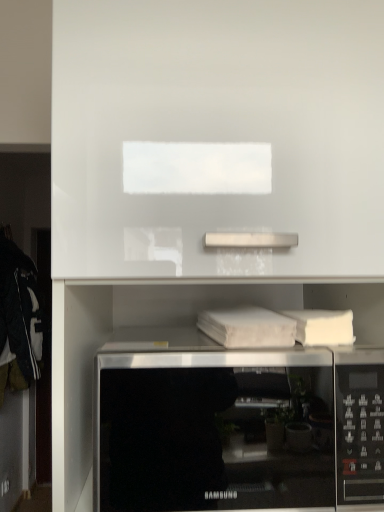
Find the location of `white matte book at center`. white matte book at center is located at coordinates (248, 328).

What do you see at coordinates (237, 430) in the screenshot?
I see `satin silver microwave at lower center` at bounding box center [237, 430].

Find the location of `white matte book at center`. white matte book at center is located at coordinates (x=248, y=328).

Which is behind, point (279, 412) or point (75, 109)?

The point (279, 412) is more distant.

Does satin silver microwave at lower center have a lesser width compared to white glossy cabinet at upper center?

Correct, the width of satin silver microwave at lower center is less than that of white glossy cabinet at upper center.

Is satin silver microwave at lower center in contact with white glossy cabinet at upper center?

No.

At what (x,y) coordinates should I click in order to perform the action: click on microwave oven below the white glossy cabinet at upper center (from a real-world perspective). Please return your answer as a coordinate pair (x, y). The width and height of the screenshot is (384, 512). Looking at the image, I should click on click(237, 430).

Which object is thinner, white glossy cabinet at upper center or white matte book at center?

white matte book at center.

Considering their positions, is white glossy cabinet at upper center located in front of or behind white matte book at center?

Clearly, white glossy cabinet at upper center is in front of white matte book at center.

Looking at this image, from the image's perspective, does white glossy cabinet at upper center appear lower than white matte book at center?

No, from the image's perspective, white glossy cabinet at upper center is not below white matte book at center.

From their relative heights in the image, would you say white glossy cabinet at upper center is taller or shorter than white matte book at center?

Considering their sizes, white glossy cabinet at upper center has more height than white matte book at center.

Which object is wider, white matte book at center or satin silver microwave at lower center?

With larger width is satin silver microwave at lower center.

Between white matte book at center and satin silver microwave at lower center, which one appears on the left side from the viewer's perspective?

satin silver microwave at lower center.

Looking at this image, which object is further away from the camera, white matte book at center or satin silver microwave at lower center?

white matte book at center is further from the camera.

Consider the image. Considering the positions of objects white glossy cabinet at upper center and satin silver microwave at lower center in the image provided, who is behind, white glossy cabinet at upper center or satin silver microwave at lower center?

satin silver microwave at lower center is more distant.

Based on the photo, is white glossy cabinet at upper center aimed at satin silver microwave at lower center?

Yes, white glossy cabinet at upper center is turned towards satin silver microwave at lower center.

Is the depth of white matte book at center greater than that of white glossy cabinet at upper center?

Yes.

Is white matte book at center turned away from white glossy cabinet at upper center?

Yes, white matte book at center is positioned with its back facing white glossy cabinet at upper center.

Between white matte book at center and white glossy cabinet at upper center, which one appears on the left side from the viewer's perspective?

white glossy cabinet at upper center is more to the left.

In terms of width, does white matte book at center look wider or thinner when compared to white glossy cabinet at upper center?

In the image, white matte book at center appears to be more narrow than white glossy cabinet at upper center.

How far apart are satin silver microwave at lower center and white matte book at center?

A distance of 8.74 inches exists between satin silver microwave at lower center and white matte book at center.

Locate an element on the screen. Image resolution: width=384 pixels, height=512 pixels. book behind the satin silver microwave at lower center is located at coordinates (248, 328).

From a real-world perspective, is satin silver microwave at lower center positioned over white matte book at center based on gravity?

Actually, satin silver microwave at lower center is physically below white matte book at center in the real world.

In the scene shown: How many degrees apart are the facing directions of satin silver microwave at lower center and white matte book at center?

The facing directions of satin silver microwave at lower center and white matte book at center are 6.23 degrees apart.

This screenshot has height=512, width=384. I want to click on cabinet located on the left of satin silver microwave at lower center, so click(220, 128).

The image size is (384, 512). I want to click on cabinet above the white matte book at center (from the image's perspective), so click(x=220, y=128).

Which object lies nearer to the anchor point white glossy cabinet at upper center, white matte book at center or satin silver microwave at lower center?

white matte book at center.

From the image, which object appears to be farther from white matte book at center, white glossy cabinet at upper center or satin silver microwave at lower center?

white glossy cabinet at upper center lies further to white matte book at center than the other object.

Estimate the real-world distances between objects in this image. Which object is closer to white glossy cabinet at upper center, satin silver microwave at lower center or white matte book at center?

white matte book at center is positioned closer to the anchor white glossy cabinet at upper center.

When comparing their distances from satin silver microwave at lower center, does white glossy cabinet at upper center or white matte book at center seem closer?

white matte book at center is closer to satin silver microwave at lower center.

When comparing their distances from white matte book at center, does satin silver microwave at lower center or white glossy cabinet at upper center seem closer?

satin silver microwave at lower center lies closer to white matte book at center than the other object.

Considering their positions, is white matte book at center positioned closer to satin silver microwave at lower center than white glossy cabinet at upper center?

The object closer to satin silver microwave at lower center is white matte book at center.

Identify the location of book between white glossy cabinet at upper center and satin silver microwave at lower center in the vertical direction. Image resolution: width=384 pixels, height=512 pixels. (248, 328).